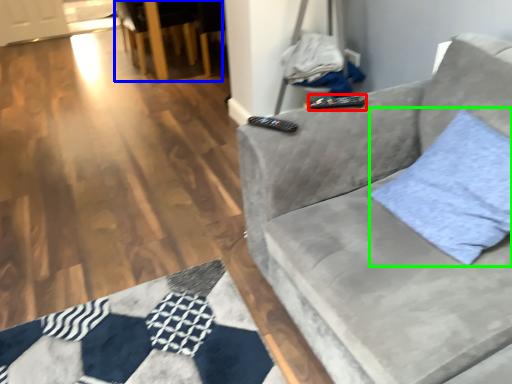
Question: Which object is positioned farthest from remote (highlighted by a red box)? Select from armchair (highlighted by a blue box) and throw pillow (highlighted by a green box).

Choices:
 (A) armchair
 (B) throw pillow

Answer: (A)